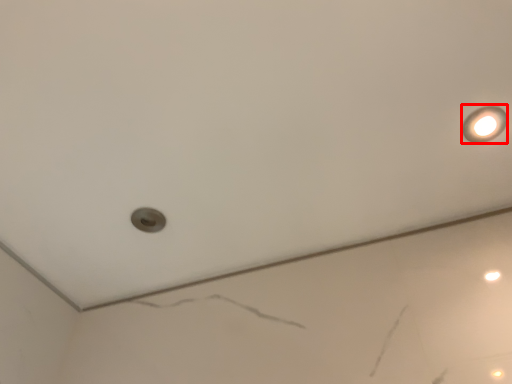
Question: Observing the image, what is the correct spatial positioning of light fixture (annotated by the red box) in reference to hole?

Choices:
 (A) left
 (B) right

Answer: (B)